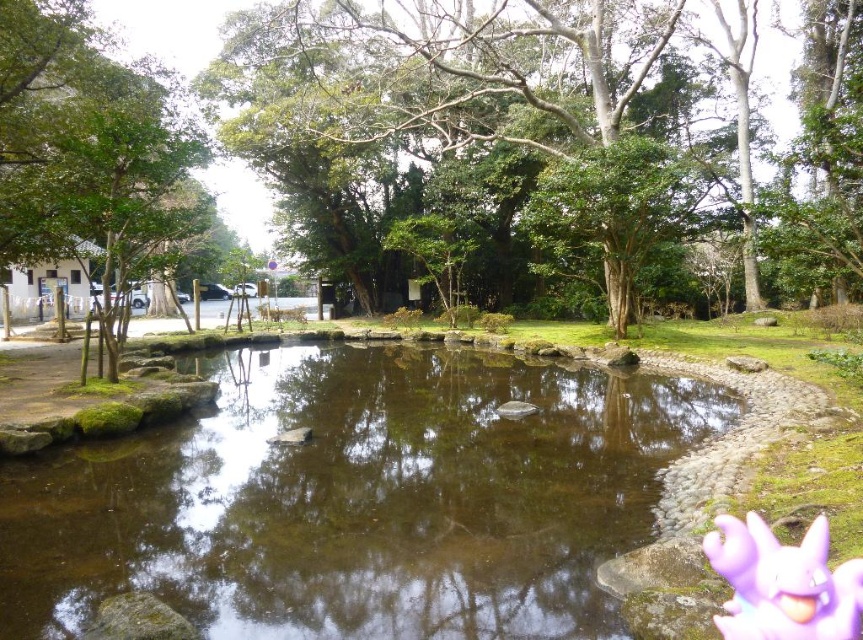
You are standing at the edge of the pond and want to look at the clear water at center and the green leafy tree at center. Which object is closer to you?

The clear water at center is closer to the viewer than the green leafy tree at center.

You are standing on the stone wall bordering the pond and want to look down into the water. Which object, the clear water at center or the green leafy tree at center, is closer to your eyes?

The clear water at center is closer to your eyes because it is located below the green leafy tree at center.

You are planning to build a small wooden dock extending into the clear water at center. Since the green leafy tree at center is nearby, will its branches block sunlight from reaching the dock? Please explain based on their sizes.

The clear water at center has a smaller size compared to the green leafy tree at center, meaning the tree is larger. Therefore, its branches are likely to block sunlight from reaching the dock.